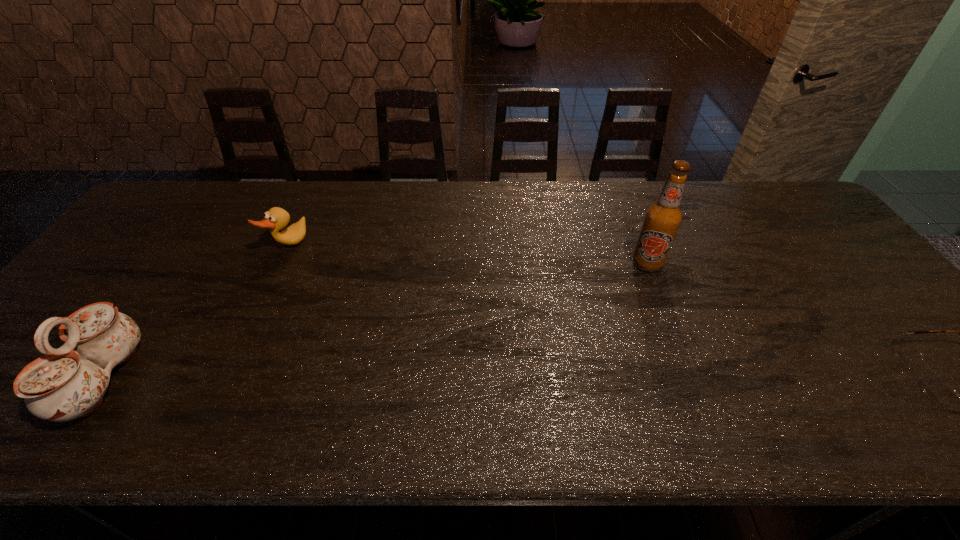
You are a GUI agent. You are given a task and a screenshot of the screen. Output one action in this format:
    pyautogui.click(x=<x>, y=<y>)
    Task: Click on the second closest object relative to the third object from right to left
    The height and width of the screenshot is (540, 960).
    Given the screenshot: What is the action you would take?
    pyautogui.click(x=663, y=218)

Choose which object is the nearest neighbor to the beer bottle. Please provide its 2D coordinates. Your answer should be formatted as a tuple, i.e. [(x, y)], where the tuple contains the x and y coordinates of a point satisfying the conditions above.

[(937, 389)]